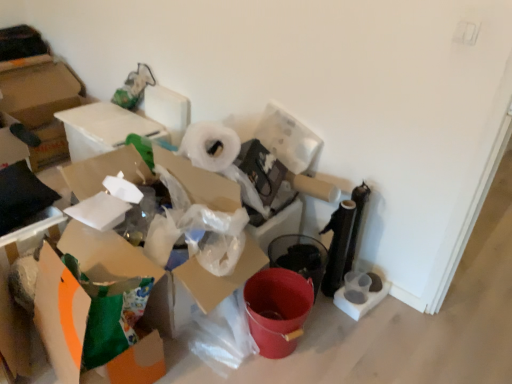
The width and height of the screenshot is (512, 384). I want to click on empty space that is ontop of white cardboard box at upper left, marked as the 3th cardboard box in a front-to-back arrangement (from a real-world perspective), so click(112, 116).